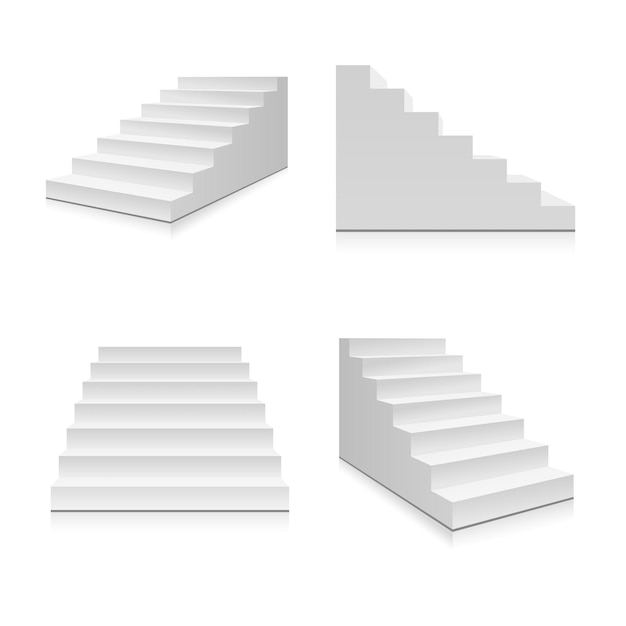
This screenshot has height=626, width=626. In order to click on white staircase in this screenshot , I will do `click(254, 475)`, `click(352, 418)`, `click(377, 206)`, `click(238, 178)`.